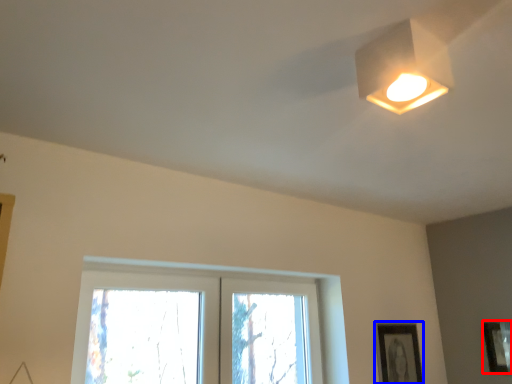
Question: Which object is closer to the camera taking this photo, picture frame (highlighted by a red box) or picture frame (highlighted by a blue box)?

Choices:
 (A) picture frame
 (B) picture frame

Answer: (A)